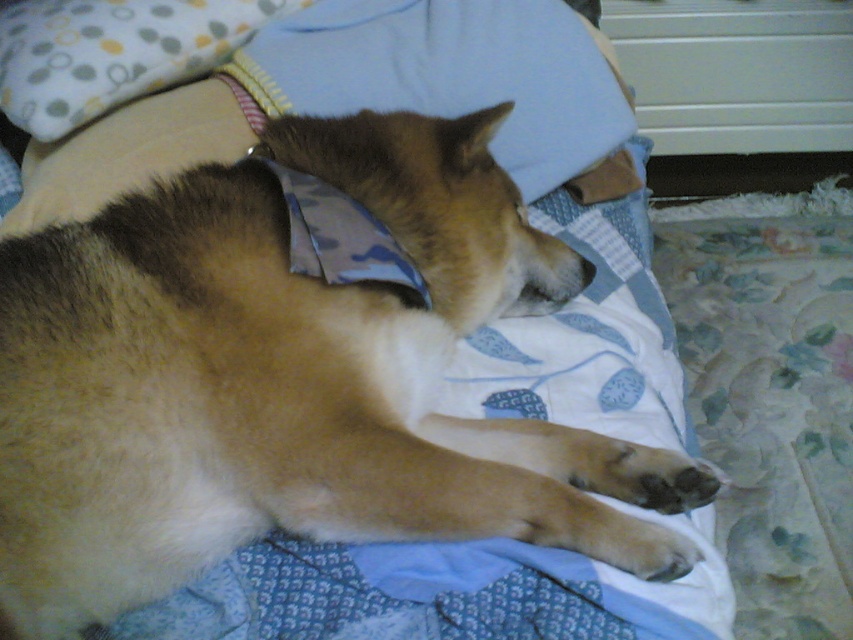
Question: Is brown fur dog at center behind soft cotton pillow at upper left?

Choices:
 (A) no
 (B) yes

Answer: (A)

Question: Which point appears closest to the camera in this image?

Choices:
 (A) (122, 275)
 (B) (262, 24)

Answer: (A)

Question: Does brown fur dog at center have a greater width compared to soft cotton pillow at upper left?

Choices:
 (A) yes
 (B) no

Answer: (A)

Question: Which point appears closest to the camera in this image?

Choices:
 (A) (271, 292)
 (B) (18, 120)

Answer: (A)

Question: In this image, where is brown fur dog at center located relative to soft cotton pillow at upper left?

Choices:
 (A) right
 (B) left

Answer: (A)